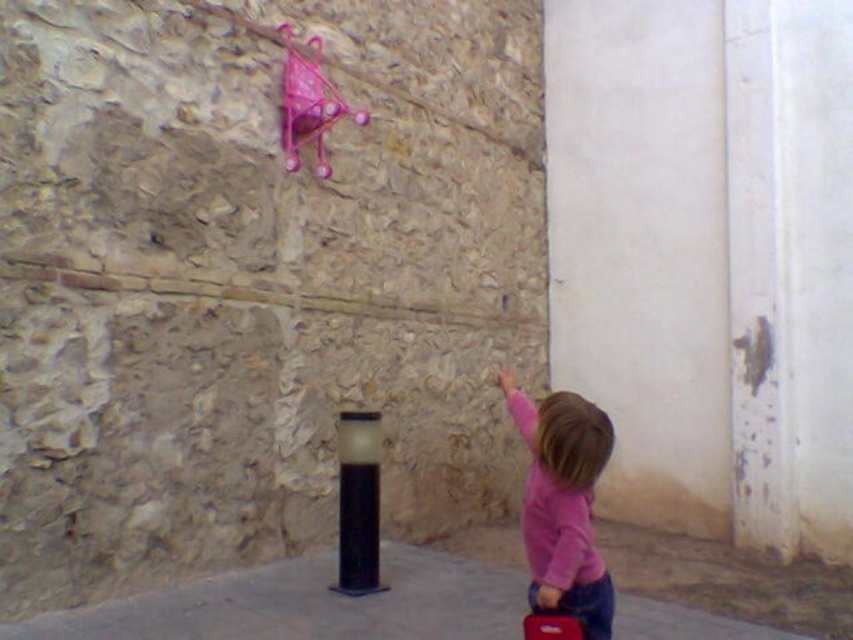
You are a delivery person trying to pass between the pink matte shirt at center and the black matte pole at center. The delivery cart you are pushing is 1.2 meters wide. Can you fit through the space between them?

The pink matte shirt at center is wider than the black matte pole at center, but the question is about the space between them. Since the objects description only provides information about their widths and not the distance between them, we cannot determine if the 1.2 meter wide delivery cart can fit through the space. Additional information about the distance between the two objects is needed to answer this question accurately.